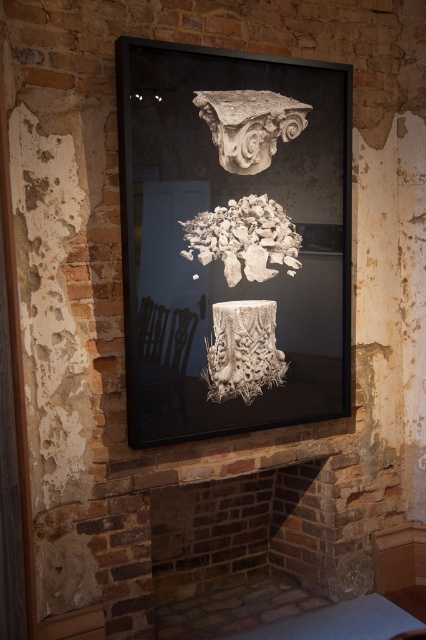
Question: Observing the image, what is the correct spatial positioning of black glass picture frame at center in reference to white textured column at center?

Choices:
 (A) below
 (B) above

Answer: (B)

Question: Which object appears closest to the camera in this image?

Choices:
 (A) white textured rubble at center
 (B) black glass picture frame at center
 (C) white textured column at center

Answer: (B)

Question: Observing the image, what is the correct spatial positioning of black glass picture frame at center in reference to white stone column capital at upper center?

Choices:
 (A) below
 (B) above

Answer: (A)

Question: Which point is farther from the camera taking this photo?

Choices:
 (A) (310, 209)
 (B) (250, 134)
 (C) (262, 227)
 (D) (253, 333)

Answer: (A)

Question: Which point is closer to the camera?

Choices:
 (A) (219, 221)
 (B) (207, 108)
 (C) (310, 182)

Answer: (B)

Question: Does black glass picture frame at center appear over white stone column capital at upper center?

Choices:
 (A) yes
 (B) no

Answer: (B)